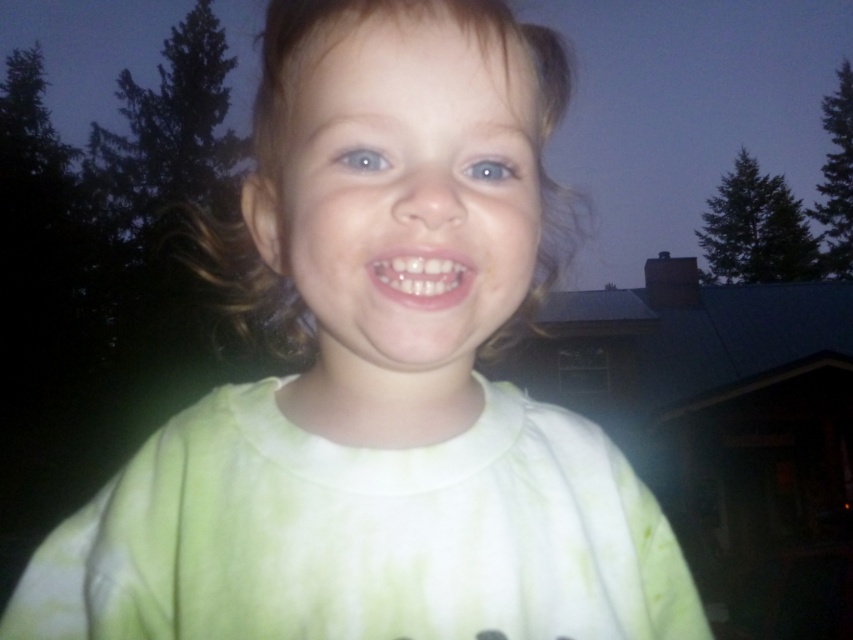
Question: Which point is farther from the camera taking this photo?

Choices:
 (A) (419, 221)
 (B) (376, 157)
 (C) (497, 180)

Answer: (C)

Question: Considering the relative positions of white glossy teeth at center and blue glossy eye at upper center in the image provided, where is white glossy teeth at center located with respect to blue glossy eye at upper center?

Choices:
 (A) left
 (B) right

Answer: (A)

Question: Which point appears farthest from the camera in this image?

Choices:
 (A) (335, 161)
 (B) (491, 177)
 (C) (419, 284)
 (D) (465, 252)

Answer: (B)

Question: Where is white glossy teeth at center located in relation to blue glossy eye at center in the image?

Choices:
 (A) below
 (B) above

Answer: (A)

Question: Which point is farther to the camera?

Choices:
 (A) (372, 154)
 (B) (309, 230)
 (C) (492, 156)

Answer: (C)

Question: Is light green fabric face at center bigger than blue glossy eye at upper center?

Choices:
 (A) no
 (B) yes

Answer: (B)